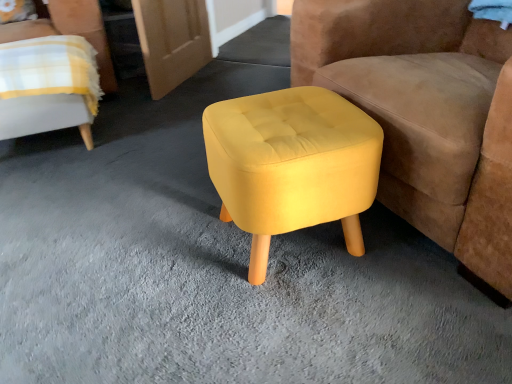
Where is `empty space that is ontop of yellow fabric stool at center (from a real-world perspective)`? empty space that is ontop of yellow fabric stool at center (from a real-world perspective) is located at coordinates (286, 122).